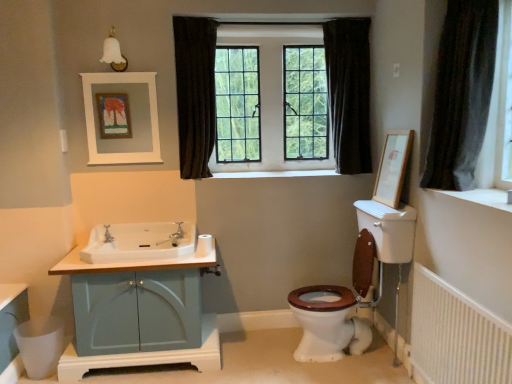
This screenshot has width=512, height=384. I want to click on white smooth window sill at upper right, marked as the 2th window sill in a back-to-front arrangement, so click(482, 197).

The image size is (512, 384). What do you see at coordinates (393, 167) in the screenshot? I see `wooden picture frame at upper right, which is the 1th picture frame in right-to-left order` at bounding box center [393, 167].

Describe the element at coordinates (275, 174) in the screenshot. I see `white smooth window sill at center, placed as the second window sill when sorted from bottom to top` at that location.

The width and height of the screenshot is (512, 384). Describe the element at coordinates (349, 92) in the screenshot. I see `dark fabric curtain at center, positioned as the first curtain in back-to-front order` at that location.

Locate an element on the screen. Image resolution: width=512 pixels, height=384 pixels. white textured radiator at lower right is located at coordinates (456, 335).

Image resolution: width=512 pixels, height=384 pixels. What do you see at coordinates (139, 242) in the screenshot?
I see `white glossy sink at center left` at bounding box center [139, 242].

The width and height of the screenshot is (512, 384). I want to click on white smooth window sill at upper right, which is counted as the 1th window sill, starting from the front, so click(482, 197).

You are a GUI agent. You are given a task and a screenshot of the screen. Output one action in this format:
    pyautogui.click(x=<x>, y=<y>)
    Task: Click on the window sill lying on the right of white smooth window sill at center, acting as the second window sill starting from the front
    The height and width of the screenshot is (384, 512).
    Given the screenshot: What is the action you would take?
    pyautogui.click(x=482, y=197)

Between white smooth window sill at center, placed as the second window sill when sorted from bottom to top, and white smooth window sill at upper right, marked as the 2th window sill in a back-to-front arrangement, which one has larger size?

Bigger between the two is white smooth window sill at center, placed as the second window sill when sorted from bottom to top.

From a real-world perspective, which object stands above the other?

From a 3D spatial view, white smooth window sill at center, marked as the 1th window sill in a left-to-right arrangement, is above.

In terms of width, does white smooth window sill at center, acting as the second window sill starting from the front, look wider or thinner when compared to white smooth window sill at upper right, which is the second window sill from top to bottom?

white smooth window sill at center, acting as the second window sill starting from the front, is wider than white smooth window sill at upper right, which is the second window sill from top to bottom.

How much distance is there between brushed metal faucet at sink left, positioned as the first tap in left-to-right order, and matte silver faucet at center, the first tap positioned from the right?

brushed metal faucet at sink left, positioned as the first tap in left-to-right order, is 40.53 centimeters away from matte silver faucet at center, the first tap positioned from the right.

From a real-world perspective, which object rests below the other?

From a 3D spatial view, brushed metal faucet at sink left, positioned as the first tap in left-to-right order, is below.

Can you tell me how much brushed metal faucet at sink left, which appears as the 2th tap when viewed from the right, and matte silver faucet at center, the first tap positioned from the right, differ in facing direction?

180 degrees.

Which object is thinner, brushed metal faucet at sink left, positioned as the first tap in left-to-right order, or matte silver faucet at center, which is the second tap from left to right?

With smaller width is brushed metal faucet at sink left, positioned as the first tap in left-to-right order.

Which of these two, clear glass windows at center or white smooth window sill at center, the 1th window sill viewed from the top, is bigger?

clear glass windows at center is bigger.

Is clear glass windows at center oriented away from white smooth window sill at center, placed as the second window sill when sorted from bottom to top?

No, clear glass windows at center is not facing the opposite direction of white smooth window sill at center, placed as the second window sill when sorted from bottom to top.

In the image, is clear glass windows at center on the left side or the right side of white smooth window sill at center, the 1th window sill viewed from the top?

From the image, it's evident that clear glass windows at center is to the left of white smooth window sill at center, the 1th window sill viewed from the top.

From the image's perspective, which is above, clear glass windows at center or white smooth window sill at center, positioned as the 1th window sill in back-to-front order?

clear glass windows at center, from the image's perspective.

Consider the image. Who is shorter, matte blue cabinet at left or white matte toilet paper at sink?

Standing shorter between the two is white matte toilet paper at sink.

Is matte blue cabinet at left in contact with white matte toilet paper at sink?

No, matte blue cabinet at left is not touching white matte toilet paper at sink.

Considering the relative sizes of matte blue cabinet at left and white matte toilet paper at sink in the image provided, is matte blue cabinet at left smaller than white matte toilet paper at sink?

Actually, matte blue cabinet at left might be larger than white matte toilet paper at sink.

Considering the relative sizes of wooden picture frame at upper right, which is the 1th picture frame in right-to-left order, and white matte picture frame at upper center, which is the 1th picture frame in left-to-right order, in the image provided, is wooden picture frame at upper right, which is the 1th picture frame in right-to-left order, bigger than white matte picture frame at upper center, which is the 1th picture frame in left-to-right order,?

Yes, wooden picture frame at upper right, which is the 1th picture frame in right-to-left order, is bigger than white matte picture frame at upper center, which is the 1th picture frame in left-to-right order.

The image size is (512, 384). Identify the location of picture frame above the wooden picture frame at upper right, which is the 1th picture frame in right-to-left order (from a real-world perspective). [94, 118].

Between wooden picture frame at upper right, which is the 1th picture frame in right-to-left order, and dark fabric curtain at upper center, the second curtain when ordered from front to back, which one has more height?

Standing taller between the two is dark fabric curtain at upper center, the second curtain when ordered from front to back.

Does wooden picture frame at upper right, the second picture frame in the left-to-right sequence, turn towards dark fabric curtain at upper center, the 3th curtain positioned from the right?

Yes, wooden picture frame at upper right, the second picture frame in the left-to-right sequence, is turned towards dark fabric curtain at upper center, the 3th curtain positioned from the right.

Would you consider wooden picture frame at upper right, which is the 1th picture frame in right-to-left order, to be distant from dark fabric curtain at upper center, the second curtain when ordered from front to back?

Yes, wooden picture frame at upper right, which is the 1th picture frame in right-to-left order, and dark fabric curtain at upper center, the second curtain when ordered from front to back, are quite far apart.

Is matte blue cabinet at left placed right next to dark fabric curtain at center, positioned as the first curtain in back-to-front order?

No, matte blue cabinet at left is not touching dark fabric curtain at center, positioned as the first curtain in back-to-front order.

From the picture: Which object is wider, matte blue cabinet at left or dark fabric curtain at center, acting as the 2th curtain starting from the right?

Answer: matte blue cabinet at left.

From the image's perspective, is matte blue cabinet at left on dark fabric curtain at center, acting as the 2th curtain starting from the right?

Actually, matte blue cabinet at left appears below dark fabric curtain at center, acting as the 2th curtain starting from the right, in the image.

Image resolution: width=512 pixels, height=384 pixels. Find the location of `window sill above the white smooth window sill at upper right, placed as the 1th window sill when sorted from right to left (from the image's perspective)`. window sill above the white smooth window sill at upper right, placed as the 1th window sill when sorted from right to left (from the image's perspective) is located at coordinates (275, 174).

This screenshot has width=512, height=384. Find the location of `tap that appears on the left of matte silver faucet at center, which is the second tap from left to right`. tap that appears on the left of matte silver faucet at center, which is the second tap from left to right is located at coordinates (108, 235).

Estimate the real-world distances between objects in this image. Which object is closer to dark fabric curtain at upper right, the first curtain when ordered from right to left, white textured radiator at lower right or clear glass windows at center?

white textured radiator at lower right lies closer to dark fabric curtain at upper right, the first curtain when ordered from right to left, than the other object.

When comparing their distances from matte blue cabinet at left, does white textured radiator at lower right or brushed metal faucet at sink left, which appears as the 2th tap when viewed from the right, seem closer?

brushed metal faucet at sink left, which appears as the 2th tap when viewed from the right, lies closer to matte blue cabinet at left than the other object.

When comparing their distances from dark fabric curtain at upper right, the first curtain when ordered from right to left, does white smooth window sill at center, positioned as the second window sill in right-to-left order, or wooden picture frame at upper right, the second picture frame in the left-to-right sequence, seem closer?

wooden picture frame at upper right, the second picture frame in the left-to-right sequence, lies closer to dark fabric curtain at upper right, the first curtain when ordered from right to left, than the other object.

When comparing their distances from dark fabric curtain at upper center, which is counted as the first curtain, starting from the left, does white matte picture frame at upper center, which is the 1th picture frame in left-to-right order, or wooden picture frame at upper right, which is the 1th picture frame in right-to-left order, seem further?

Based on the image, wooden picture frame at upper right, which is the 1th picture frame in right-to-left order, appears to be further to dark fabric curtain at upper center, which is counted as the first curtain, starting from the left.

Estimate the real-world distances between objects in this image. Which object is further from white smooth window sill at center, positioned as the 1th window sill in back-to-front order, dark fabric curtain at upper right, the first curtain when ordered from right to left, or white glossy sink at center left?

dark fabric curtain at upper right, the first curtain when ordered from right to left, is positioned further to the anchor white smooth window sill at center, positioned as the 1th window sill in back-to-front order.

When comparing their distances from dark fabric curtain at upper right, the first curtain when ordered from right to left, does brushed metal faucet at sink left, which appears as the 2th tap when viewed from the right, or dark fabric curtain at upper center, which is counted as the first curtain, starting from the left, seem further?

Among the two, brushed metal faucet at sink left, which appears as the 2th tap when viewed from the right, is located further to dark fabric curtain at upper right, the first curtain when ordered from right to left.

When comparing their distances from dark fabric curtain at center, positioned as the first curtain in back-to-front order, does wooden picture frame at upper right, which is the 1th picture frame in right-to-left order, or white matte picture frame at upper center, which is the 1th picture frame in left-to-right order, seem closer?

wooden picture frame at upper right, which is the 1th picture frame in right-to-left order, is positioned closer to the anchor dark fabric curtain at center, positioned as the first curtain in back-to-front order.

Estimate the real-world distances between objects in this image. Which object is closer to white smooth window sill at upper right, placed as the 1th window sill when sorted from right to left, dark fabric curtain at upper center, marked as the second curtain in a back-to-front arrangement, or white matte toilet paper at sink?

white matte toilet paper at sink is closer to white smooth window sill at upper right, placed as the 1th window sill when sorted from right to left.

This screenshot has width=512, height=384. Identify the location of toilet paper between dark fabric curtain at upper center, the second curtain when ordered from front to back, and white glossy sink at center left, in the vertical direction. click(204, 245).

Where is `bay window between white glossy sink at center left and wooden picture frame at upper right, the second picture frame in the left-to-right sequence`? bay window between white glossy sink at center left and wooden picture frame at upper right, the second picture frame in the left-to-right sequence is located at coordinates (271, 107).

Where is `window sill located between white glossy sink at center left and dark fabric curtain at center, positioned as the first curtain in back-to-front order, in the left-right direction`? window sill located between white glossy sink at center left and dark fabric curtain at center, positioned as the first curtain in back-to-front order, in the left-right direction is located at coordinates (275, 174).

Locate an element on the screen. This screenshot has width=512, height=384. toilet paper between dark fabric curtain at upper center, which is counted as the first curtain, starting from the left, and wooden picture frame at upper right, which is the 1th picture frame in right-to-left order, from left to right is located at coordinates (204, 245).